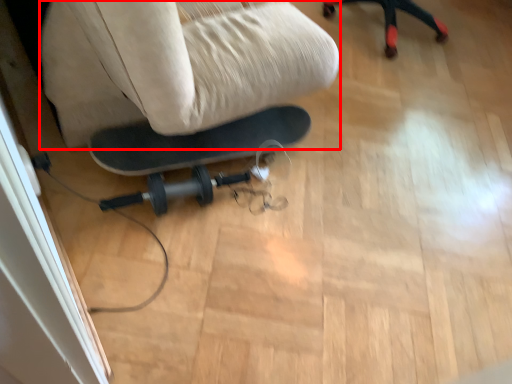
Question: From the image's perspective, what is the correct spatial relationship of swivel chair (annotated by the red box) in relation to screen door?

Choices:
 (A) below
 (B) above

Answer: (B)